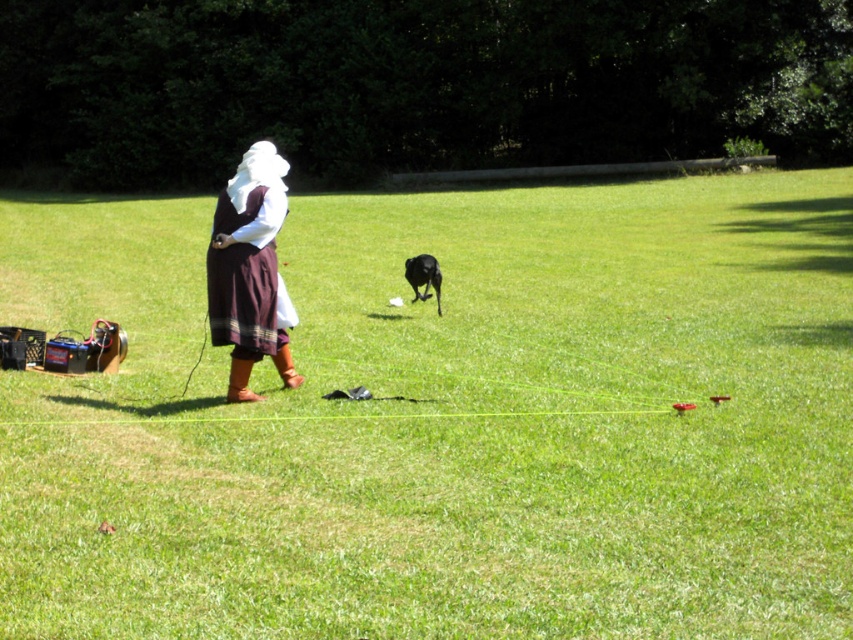
Question: Based on their relative distances, which object is nearer to the green grassy field at center?

Choices:
 (A) brown woven skirt at center
 (B) black glossy dog at center

Answer: (B)

Question: Which point is closer to the camera?

Choices:
 (A) brown woven skirt at center
 (B) black glossy dog at center
 (C) green grassy field at center

Answer: (C)

Question: Is green grassy field at center to the right of brown woven skirt at center from the viewer's perspective?

Choices:
 (A) yes
 (B) no

Answer: (A)

Question: Can you confirm if brown woven skirt at center is smaller than black glossy dog at center?

Choices:
 (A) no
 (B) yes

Answer: (B)

Question: Does green grassy field at center appear over brown woven skirt at center?

Choices:
 (A) no
 (B) yes

Answer: (B)

Question: Estimate the real-world distances between objects in this image. Which object is closer to the black glossy dog at center?

Choices:
 (A) green grassy field at center
 (B) brown woven skirt at center

Answer: (A)